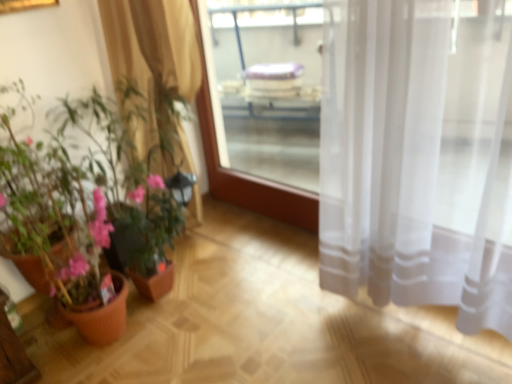
Where is `empty space that is to the right of terracotta pot plant at left`? This screenshot has height=384, width=512. empty space that is to the right of terracotta pot plant at left is located at coordinates (219, 342).